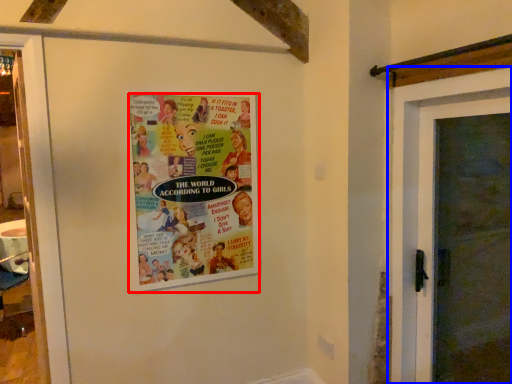
Question: Which object is further to the camera taking this photo, poster (highlighted by a red box) or door (highlighted by a blue box)?

Choices:
 (A) poster
 (B) door

Answer: (A)